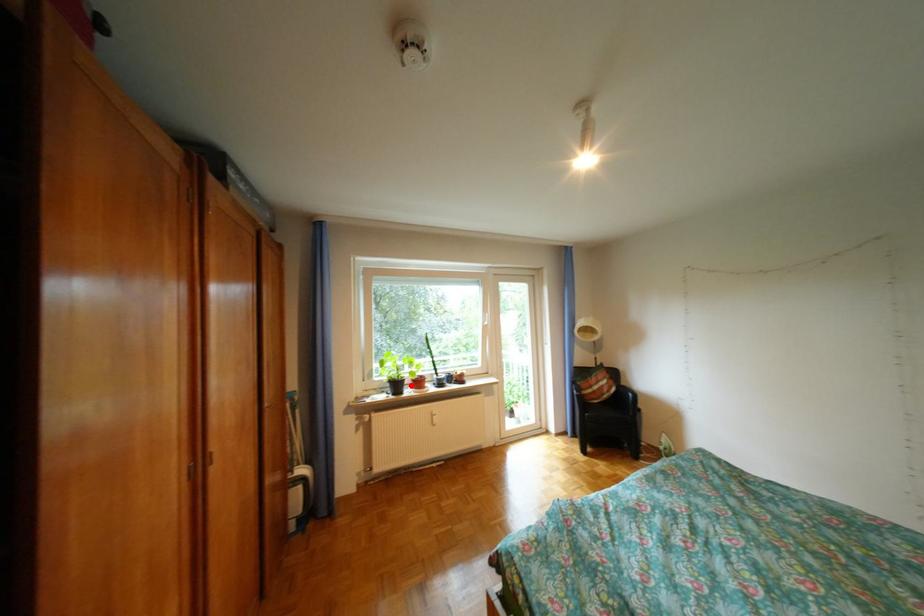
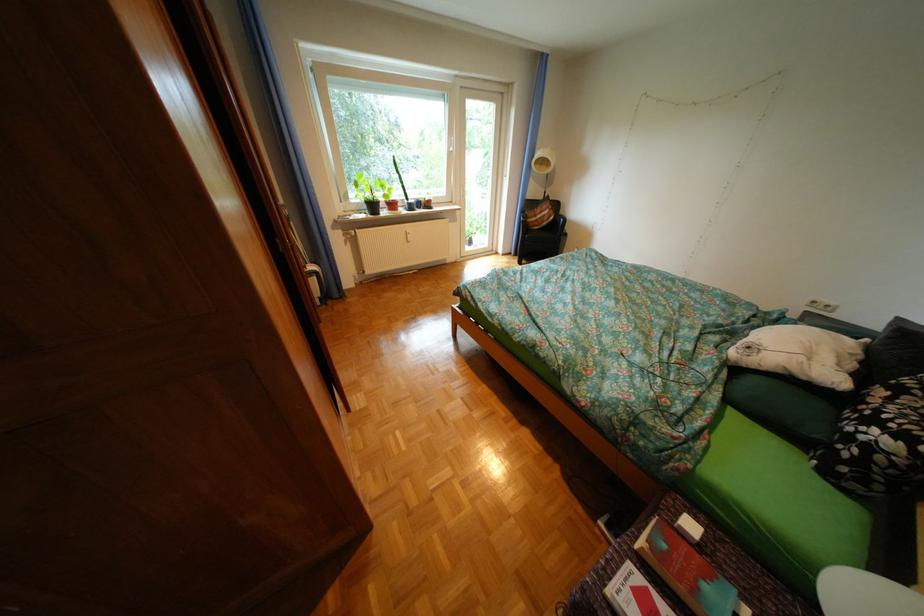
Question: I am providing you with two images of the same scene from different viewpoints. A red point is shown in image1. For the corresponding object point in image2, is it positioned nearer or farther from the camera?

Choices:
 (A) Nearer
 (B) Farther

Answer: (A)